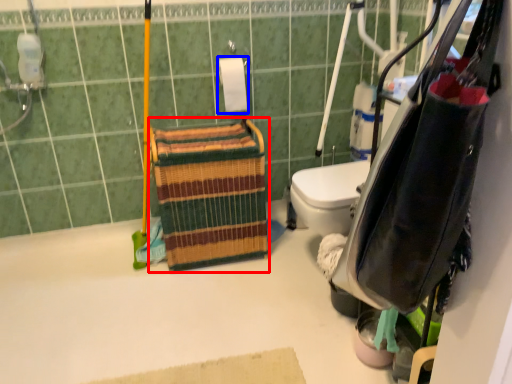
Question: Among these objects, which one is nearest to the camera, basket (highlighted by a red box) or toilet paper (highlighted by a blue box)?

Choices:
 (A) basket
 (B) toilet paper

Answer: (A)